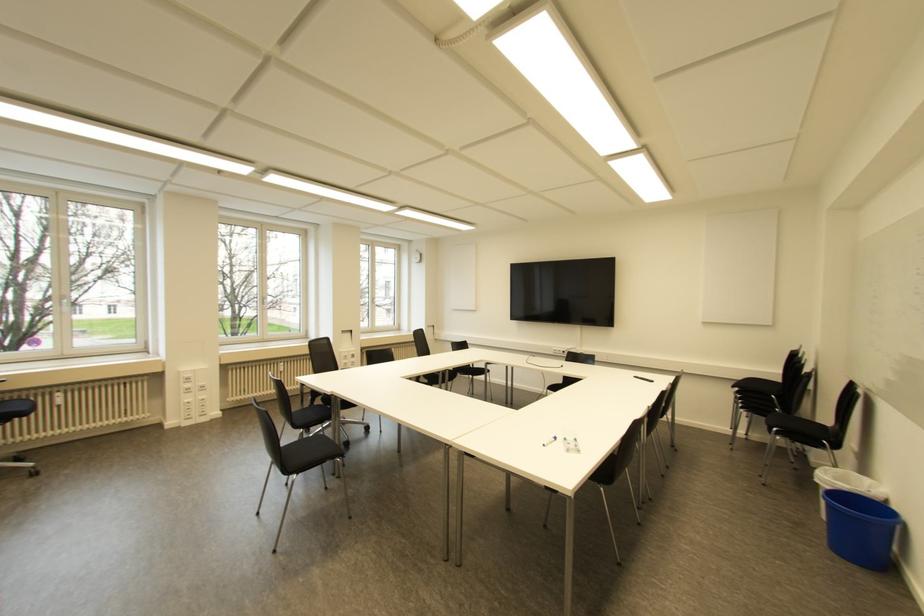
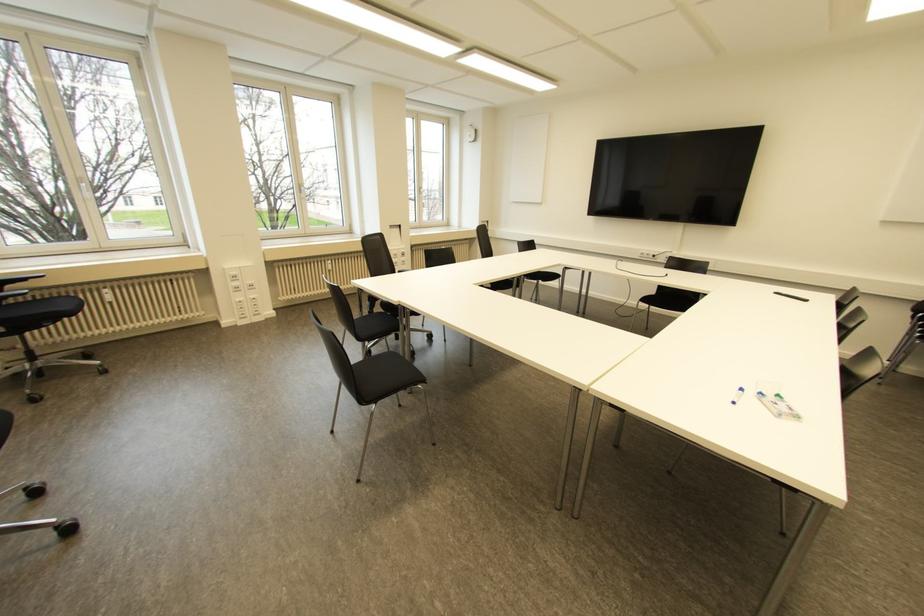
Locate, in the second image, the point that corresponds to [554,438] in the first image.

(739, 390)